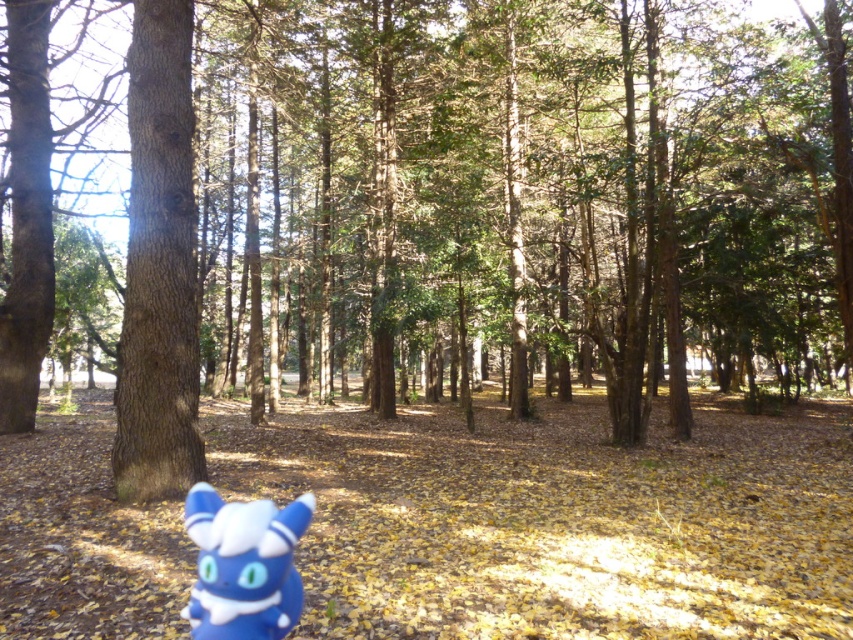
You are standing in the forest scene described. There is a smooth brown tree trunk at center located at point (158, 266). If you were to walk directly towards this tree trunk, which direction should you head?

You should head directly towards the center of the forest scene where the smooth brown tree trunk at center is located at point (158, 266).

Based on the photo, you are a hiker who has just entered the forest and sees the smooth brown tree trunk at center and the blue plush toy at lower left. Which object is closer to the ground?

The smooth brown tree trunk at center is located below the blue plush toy at lower left, so it is closer to the ground.

You are a hiker walking through the forest and spot the blue plush toy at lower left and the smooth brown tree trunk at center. Which object is closer to you as you stand in the scene?

The smooth brown tree trunk at center is closer to you because the blue plush toy at lower left is positioned behind it.